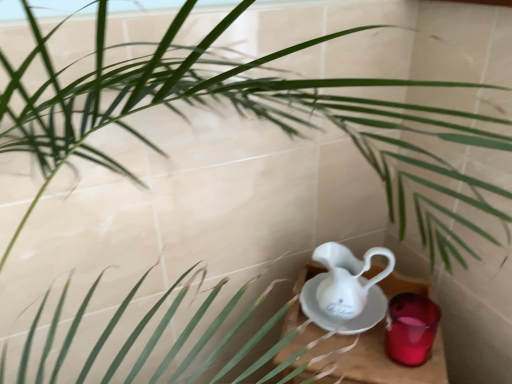
Locate an element on the screen. The image size is (512, 384). wooden table at lower right is located at coordinates (379, 363).

The width and height of the screenshot is (512, 384). What do you see at coordinates (411, 329) in the screenshot?
I see `translucent glass candle at lower right` at bounding box center [411, 329].

Describe the element at coordinates (347, 278) in the screenshot. The image size is (512, 384). I see `white porcelain jug at lower right` at that location.

In order to click on wooden table at lower right in this screenshot , I will do `click(379, 363)`.

Is translucent glass candle at lower right at the right side of white porcelain jug at lower right?

Yes, translucent glass candle at lower right is to the right of white porcelain jug at lower right.

From the picture: Which is less distant, (412, 345) or (360, 313)?

Clearly, point (412, 345) is closer to the camera than point (360, 313).

Is translucent glass candle at lower right positioned with its back to white porcelain jug at lower right?

No, translucent glass candle at lower right is not facing away from white porcelain jug at lower right.

From a real-world perspective, is translucent glass candle at lower right positioned under white porcelain jug at lower right based on gravity?

Yes, from a real-world perspective, translucent glass candle at lower right is below white porcelain jug at lower right.

Is wooden table at lower right spatially inside translucent glass candle at lower right, or outside of it?

wooden table at lower right is not enclosed by translucent glass candle at lower right.

Which of these two, wooden table at lower right or translucent glass candle at lower right, is wider?

With larger width is wooden table at lower right.

Who is smaller, wooden table at lower right or translucent glass candle at lower right?

With smaller size is translucent glass candle at lower right.

Is wooden table at lower right positioned with its back to translucent glass candle at lower right?

Result: No, wooden table at lower right is not facing away from translucent glass candle at lower right.

Is wooden table at lower right spatially inside white porcelain jug at lower right, or outside of it?

wooden table at lower right is spatially situated outside white porcelain jug at lower right.

Could you tell me if wooden table at lower right is facing white porcelain jug at lower right?

No.

Is wooden table at lower right next to white porcelain jug at lower right and touching it?

Yes, wooden table at lower right is touching white porcelain jug at lower right.

How many degrees apart are the facing directions of wooden table at lower right and white porcelain jug at lower right?

There is a 8.34-degree angle between the facing directions of wooden table at lower right and white porcelain jug at lower right.

Between translucent glass candle at lower right and wooden table at lower right, which one has less height?

With less height is translucent glass candle at lower right.

Which object is positioned more to the right, translucent glass candle at lower right or wooden table at lower right?

From the viewer's perspective, translucent glass candle at lower right appears more on the right side.

Based on the photo, looking at the image, does translucent glass candle at lower right seem bigger or smaller compared to wooden table at lower right?

In the image, translucent glass candle at lower right appears to be smaller than wooden table at lower right.

Looking at their sizes, would you say translucent glass candle at lower right is wider or thinner than wooden table at lower right?

In the image, translucent glass candle at lower right appears to be more narrow than wooden table at lower right.

From the image's perspective, between white porcelain jug at lower right and translucent glass candle at lower right, who is located below?

translucent glass candle at lower right, from the image's perspective.

Based on the photo, measure the distance from white porcelain jug at lower right to translucent glass candle at lower right.

white porcelain jug at lower right is 5.05 inches from translucent glass candle at lower right.

Can you confirm if white porcelain jug at lower right is bigger than translucent glass candle at lower right?

Indeed, white porcelain jug at lower right has a larger size compared to translucent glass candle at lower right.

Considering the positions of point (335, 259) and point (415, 323), is point (335, 259) closer or farther from the camera than point (415, 323)?

Clearly, point (335, 259) is more distant from the camera than point (415, 323).

Can you tell me how much white porcelain jug at lower right and wooden table at lower right differ in facing direction?

The angular difference between white porcelain jug at lower right and wooden table at lower right is 8.34 degrees.

Is white porcelain jug at lower right positioned behind wooden table at lower right?

That is False.

From the picture: Is white porcelain jug at lower right oriented away from wooden table at lower right?

No.

Does white porcelain jug at lower right touch wooden table at lower right?

Yes.

Locate an element on the screen. This screenshot has height=384, width=512. jug that appears above the translucent glass candle at lower right (from a real-world perspective) is located at coordinates (347, 278).

Locate an element on the screen. Image resolution: width=512 pixels, height=384 pixels. tableware behind the wooden table at lower right is located at coordinates (411, 329).

Estimate the real-world distances between objects in this image. Which object is further from translucent glass candle at lower right, white porcelain jug at lower right or wooden table at lower right?

Among the two, white porcelain jug at lower right is located further to translucent glass candle at lower right.

From the image, which object appears to be farther from wooden table at lower right, translucent glass candle at lower right or white porcelain jug at lower right?

Among the two, white porcelain jug at lower right is located further to wooden table at lower right.

Based on their spatial positions, is wooden table at lower right or translucent glass candle at lower right closer to white porcelain jug at lower right?

wooden table at lower right is closer to white porcelain jug at lower right.

Estimate the real-world distances between objects in this image. Which object is closer to wooden table at lower right, white porcelain jug at lower right or translucent glass candle at lower right?

Based on the image, translucent glass candle at lower right appears to be nearer to wooden table at lower right.

Based on their spatial positions, is translucent glass candle at lower right or wooden table at lower right closer to white porcelain jug at lower right?

wooden table at lower right lies closer to white porcelain jug at lower right than the other object.

From the image, which object appears to be farther from translucent glass candle at lower right, wooden table at lower right or white porcelain jug at lower right?

white porcelain jug at lower right lies further to translucent glass candle at lower right than the other object.

Where is `tableware between white porcelain jug at lower right and wooden table at lower right in the vertical direction`? tableware between white porcelain jug at lower right and wooden table at lower right in the vertical direction is located at coordinates (411, 329).